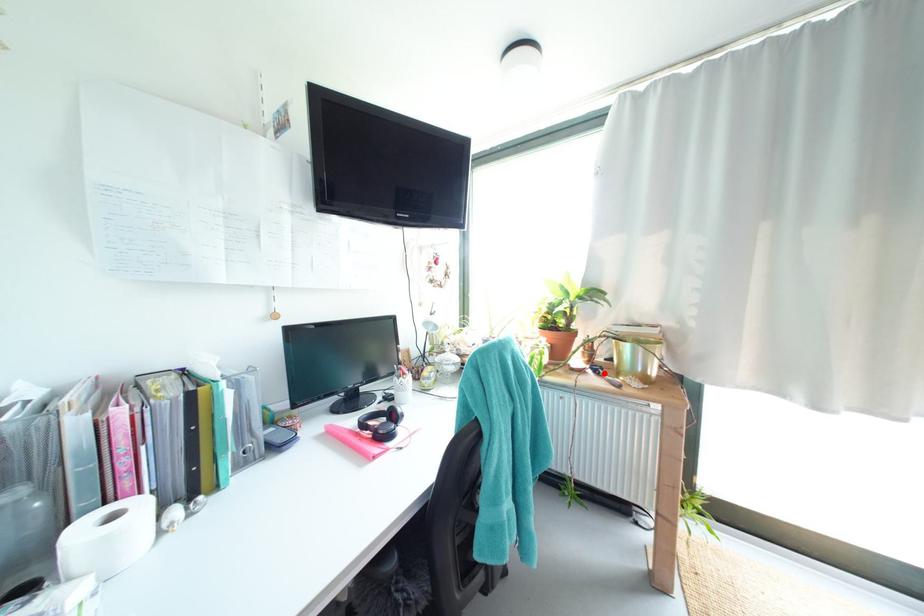
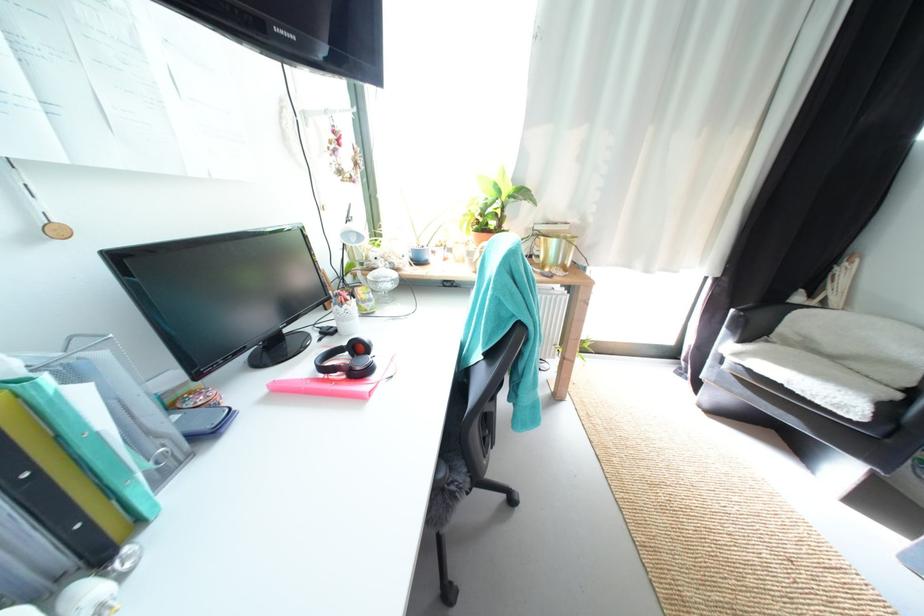
Question: I am providing you with two images of the same scene from different viewpoints. A red point is shown in image1. For the corresponding object point in image2, is it positioned nearer or farther from the camera?

Choices:
 (A) Nearer
 (B) Farther

Answer: (B)